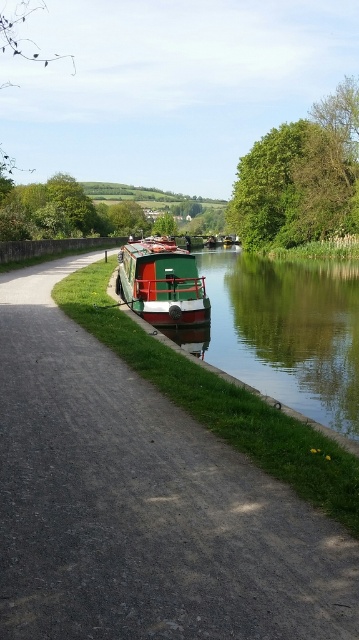
Question: Among these points, which one is nearest to the camera?

Choices:
 (A) (146, 250)
 (B) (278, 300)
 (C) (36, 307)

Answer: (C)

Question: Which point is closer to the camera taking this photo?

Choices:
 (A) (231, 195)
 (B) (114, 289)
 (C) (311, 353)
 (D) (347, 572)

Answer: (D)

Question: Is green glossy boat at center closer to camera compared to green polished wood barge at center?

Choices:
 (A) yes
 (B) no

Answer: (A)

Question: Which point is farther to the camera?

Choices:
 (A) green polished wood barge at center
 (B) green glossy boat at center
 (C) green matte boat at center
 (D) green leafy tree at upper right

Answer: (D)

Question: Does green matte boat at center have a smaller size compared to green leafy tree at upper right?

Choices:
 (A) yes
 (B) no

Answer: (A)

Question: Does green leafy tree at upper right have a larger size compared to green polished wood barge at center?

Choices:
 (A) yes
 (B) no

Answer: (A)